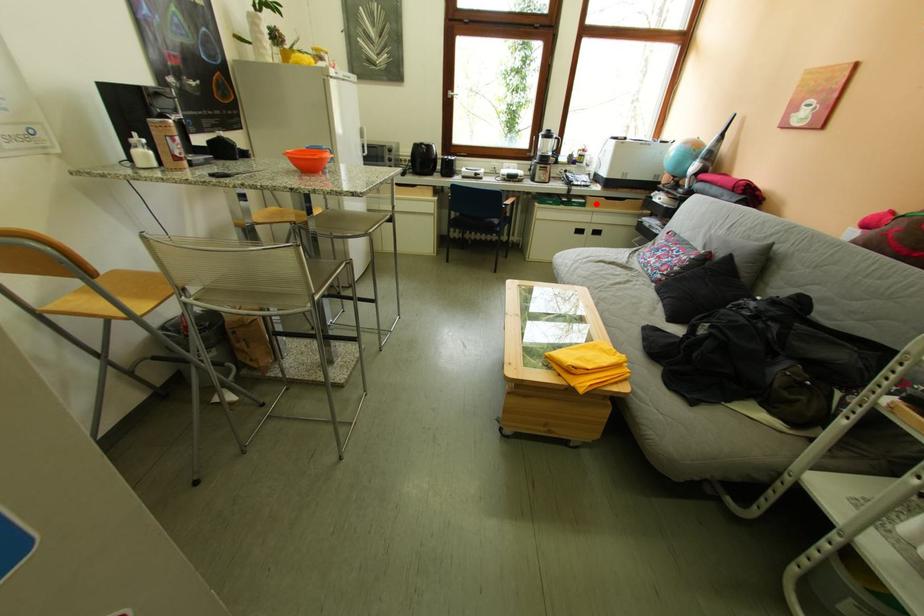
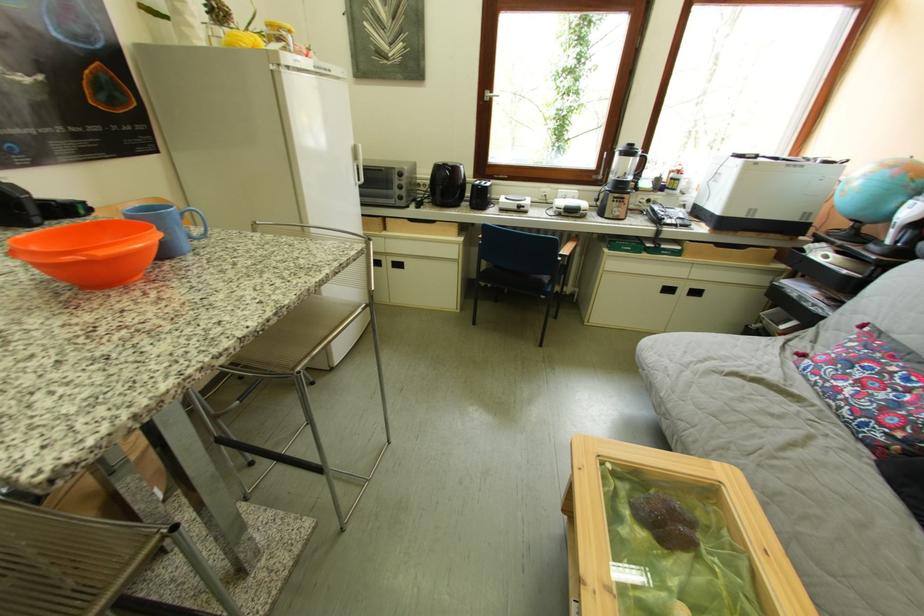
Question: I am providing you with two images of the same scene from different viewpoints. Image1 has a red point marked. In image2, the corresponding 3D location appears at what relative position? Reply with the corresponding letter.

Choices:
 (A) Closer
 (B) Farther

Answer: (B)